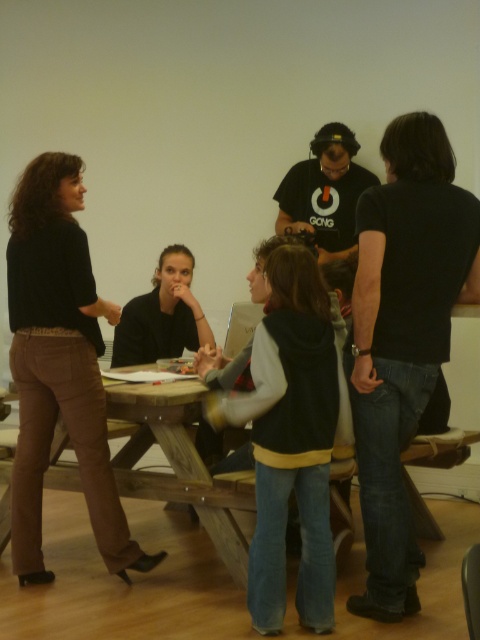
Question: Which object is farther from the camera taking this photo?

Choices:
 (A) brown cotton pants at left
 (B) black cotton shirt at right
 (C) wooden picnic table at center

Answer: (A)

Question: Which point is farther to the camera?

Choices:
 (A) (418, 346)
 (B) (54, 244)

Answer: (B)

Question: Can you confirm if wooden picnic table at center is positioned to the left of black matte shirt at center?

Choices:
 (A) no
 (B) yes

Answer: (A)

Question: Which point is farther from the camera taking this photo?

Choices:
 (A) (371, 268)
 (B) (44, 472)
 (C) (326, 348)
 (D) (204, 342)

Answer: (D)

Question: Does black cotton shirt at right have a lesser width compared to black matte shirt at center?

Choices:
 (A) yes
 (B) no

Answer: (A)

Question: Is wooden picnic table at center positioned behind black matte shirt at center?

Choices:
 (A) yes
 (B) no

Answer: (B)